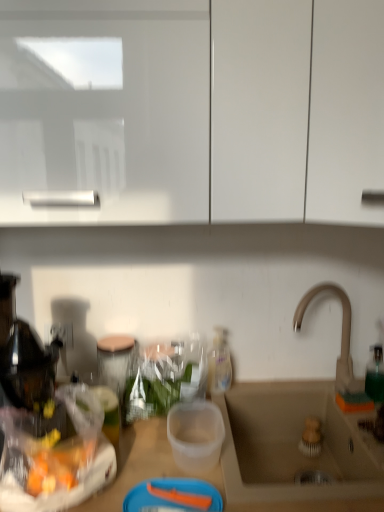
Question: Considering the relative positions of translucent plastic bottle at center and white glossy cabinet at upper center in the image provided, is translucent plastic bottle at center to the right of white glossy cabinet at upper center from the viewer's perspective?

Choices:
 (A) yes
 (B) no

Answer: (A)

Question: Is translucent plastic bottle at center bigger than white glossy cabinet at upper center?

Choices:
 (A) no
 (B) yes

Answer: (A)

Question: Can you confirm if translucent plastic bottle at center is thinner than white glossy cabinet at upper center?

Choices:
 (A) yes
 (B) no

Answer: (A)

Question: From a real-world perspective, is translucent plastic bottle at center beneath white glossy cabinet at upper center?

Choices:
 (A) no
 (B) yes

Answer: (B)

Question: Can you confirm if translucent plastic bottle at center is positioned to the left of white glossy cabinet at upper center?

Choices:
 (A) no
 (B) yes

Answer: (A)

Question: Is translucent plastic bottle at center smaller than white glossy cabinet at upper center?

Choices:
 (A) yes
 (B) no

Answer: (A)

Question: Considering the relative positions of white glossy cabinet at upper center and translucent plastic bottle at center in the image provided, is white glossy cabinet at upper center to the right of translucent plastic bottle at center from the viewer's perspective?

Choices:
 (A) no
 (B) yes

Answer: (A)

Question: Is white glossy cabinet at upper center positioned behind translucent plastic bottle at center?

Choices:
 (A) yes
 (B) no

Answer: (B)

Question: From a real-world perspective, is white glossy cabinet at upper center physically above translucent plastic bottle at center?

Choices:
 (A) yes
 (B) no

Answer: (A)

Question: Considering the relative sizes of white glossy cabinet at upper center and translucent plastic bottle at center in the image provided, is white glossy cabinet at upper center wider than translucent plastic bottle at center?

Choices:
 (A) yes
 (B) no

Answer: (A)

Question: Are white glossy cabinet at upper center and translucent plastic bottle at center beside each other?

Choices:
 (A) no
 (B) yes

Answer: (A)

Question: Would you consider white glossy cabinet at upper center to be distant from translucent plastic bottle at center?

Choices:
 (A) no
 (B) yes

Answer: (A)

Question: Is white glossy cabinet at upper center at the back of beige ceramic sink at lower right?

Choices:
 (A) no
 (B) yes

Answer: (A)